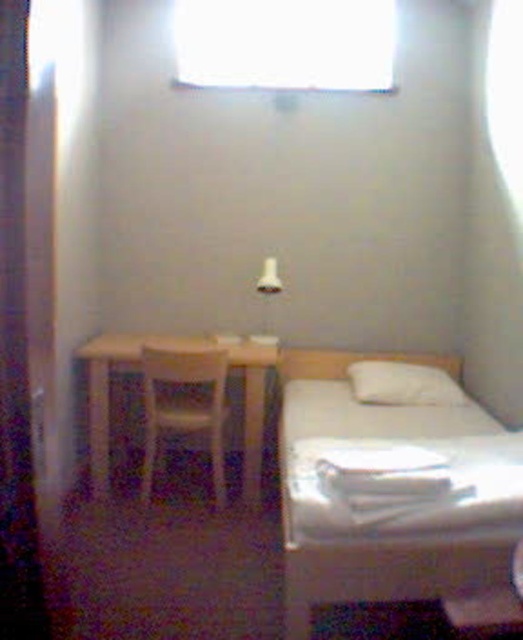
Question: Estimate the real-world distances between objects in this image. Which object is closer to the white plastic chair at left?

Choices:
 (A) white soft pillow at upper center
 (B) white fabric curtain at left
 (C) transparent glass window at upper center

Answer: (A)

Question: Based on their relative distances, which object is farther from the light wood table at center?

Choices:
 (A) white soft pillow at upper center
 (B) white glossy lampshade at upper center
 (C) transparent glass window at upper center

Answer: (C)

Question: Which of the following is the farthest from the observer?

Choices:
 (A) white smooth bed at center
 (B) white soft pillow at upper center
 (C) transparent glass window at upper center
 (D) light wood table at center

Answer: (C)

Question: Is white fabric curtain at left in front of white plastic chair at left?

Choices:
 (A) no
 (B) yes

Answer: (B)

Question: Can you confirm if white smooth bed at center is wider than white fabric curtain at left?

Choices:
 (A) no
 (B) yes

Answer: (B)

Question: Does transparent glass window at upper center appear on the right side of white soft pillow at upper center?

Choices:
 (A) yes
 (B) no

Answer: (B)